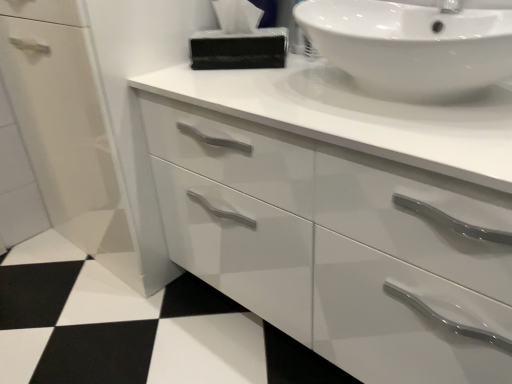
Question: Considering the relative sizes of white glossy sink at upper right and black glossy tissue at upper center in the image provided, is white glossy sink at upper right taller than black glossy tissue at upper center?

Choices:
 (A) yes
 (B) no

Answer: (A)

Question: From a real-world perspective, is white glossy sink at upper right located beneath black glossy tissue at upper center?

Choices:
 (A) no
 (B) yes

Answer: (A)

Question: Is white glossy sink at upper right to the right of black glossy tissue at upper center from the viewer's perspective?

Choices:
 (A) no
 (B) yes

Answer: (B)

Question: Can you confirm if white glossy sink at upper right is thinner than black glossy tissue at upper center?

Choices:
 (A) no
 (B) yes

Answer: (A)

Question: Considering the relative sizes of white glossy sink at upper right and black glossy tissue at upper center in the image provided, is white glossy sink at upper right smaller than black glossy tissue at upper center?

Choices:
 (A) yes
 (B) no

Answer: (B)

Question: From the image's perspective, would you say white glossy sink at upper right is positioned over black glossy tissue at upper center?

Choices:
 (A) no
 (B) yes

Answer: (A)

Question: Is black glossy tissue at upper center positioned beyond the bounds of white glossy sink at upper right?

Choices:
 (A) yes
 (B) no

Answer: (A)

Question: Can you confirm if black glossy tissue at upper center is smaller than white glossy sink at upper right?

Choices:
 (A) no
 (B) yes

Answer: (B)

Question: Is black glossy tissue at upper center facing towards white glossy sink at upper right?

Choices:
 (A) yes
 (B) no

Answer: (B)

Question: From the image's perspective, is black glossy tissue at upper center below white glossy sink at upper right?

Choices:
 (A) yes
 (B) no

Answer: (B)

Question: Does black glossy tissue at upper center have a lesser height compared to white glossy sink at upper right?

Choices:
 (A) yes
 (B) no

Answer: (A)

Question: Is the surface of black glossy tissue at upper center in direct contact with white glossy sink at upper right?

Choices:
 (A) no
 (B) yes

Answer: (A)

Question: From a real-world perspective, relative to white glossy sink at upper right, is black glossy tissue at upper center vertically above or below?

Choices:
 (A) above
 (B) below

Answer: (B)